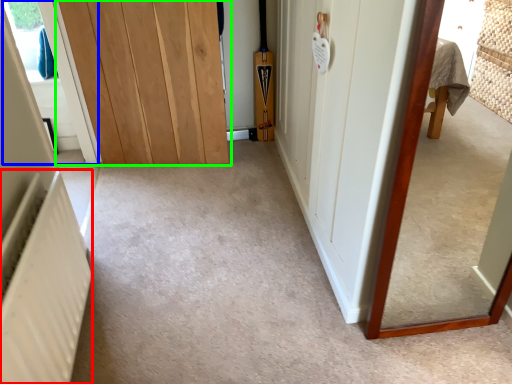
Question: Which object is the closest to the radiator (highlighted by a red box)? Choose among these: window (highlighted by a blue box) or door (highlighted by a green box).

Choices:
 (A) window
 (B) door

Answer: (B)